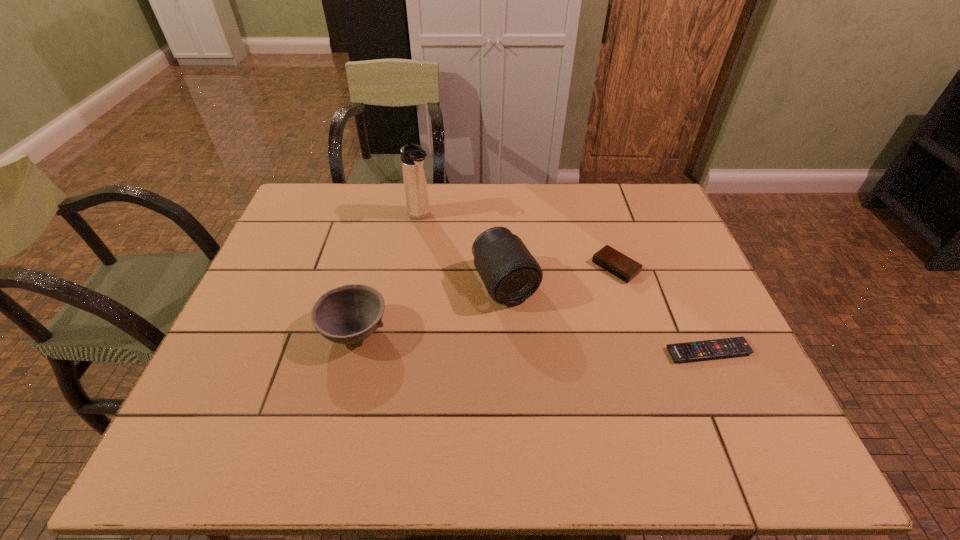
I want to click on free space located 0.290m on the front face of the second shortest object, so pos(532,335).

Locate an element on the screen. The height and width of the screenshot is (540, 960). vacant region located on the front face of the second shortest object is located at coordinates (548, 322).

Where is `vacant space situated 0.200m on the handle side of the farthest object`? This screenshot has width=960, height=540. vacant space situated 0.200m on the handle side of the farthest object is located at coordinates (457, 261).

Identify the location of vacant region located on the handle side of the farthest object. (439, 240).

Identify the location of blank space located 0.390m on the handle side of the farthest object. The height and width of the screenshot is (540, 960). (492, 302).

Where is `vacant point located 0.220m on the surface of the telephoto lens`? vacant point located 0.220m on the surface of the telephoto lens is located at coordinates (559, 380).

At what (x,y) coordinates should I click in order to perform the action: click on free space located 0.290m on the surface of the telephoto lens. Please return your answer as a coordinate pair (x, y). Looking at the image, I should click on (574, 406).

At what (x,y) coordinates should I click in order to perform the action: click on blank space located 0.190m on the surface of the telephoto lens. Please return your answer as a coordinate pair (x, y). Looking at the image, I should click on (553, 369).

Image resolution: width=960 pixels, height=540 pixels. I want to click on object present at the far edge, so click(412, 156).

Locate an element on the screen. object at the right edge is located at coordinates (689, 351).